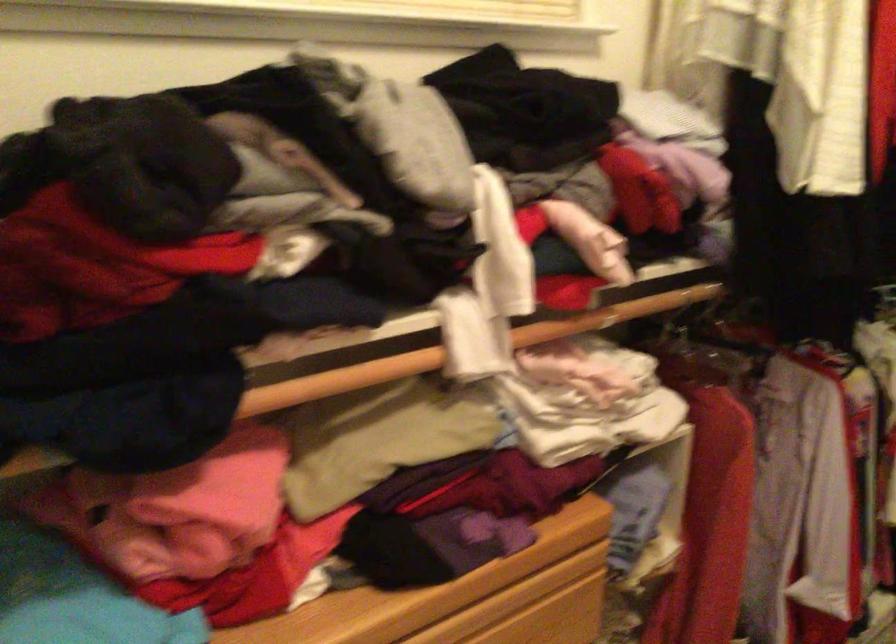
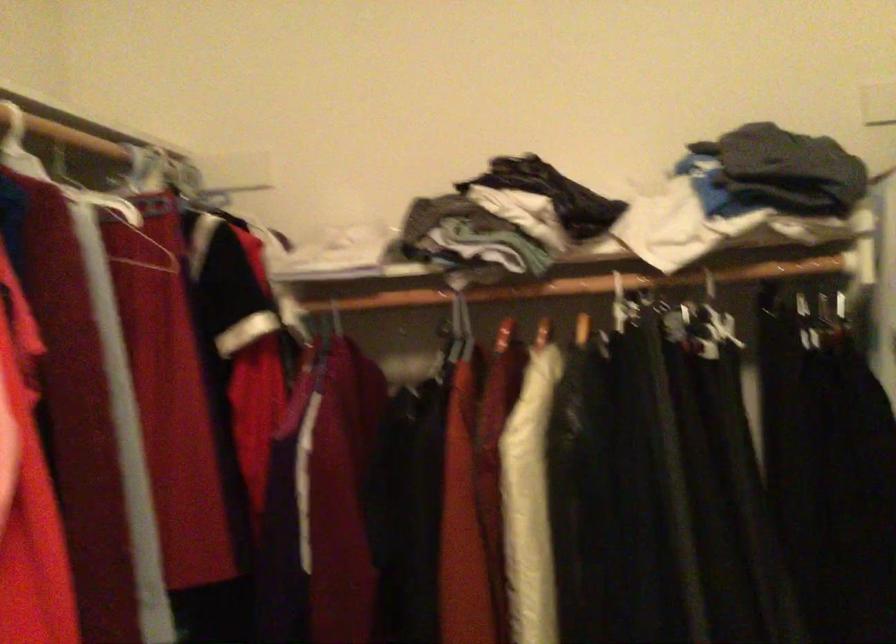
Question: The images are taken continuously from a first-person perspective. In which direction is your viewpoint rotating?

Choices:
 (A) Left
 (B) Right
 (C) Up
 (D) Down

Answer: (B)